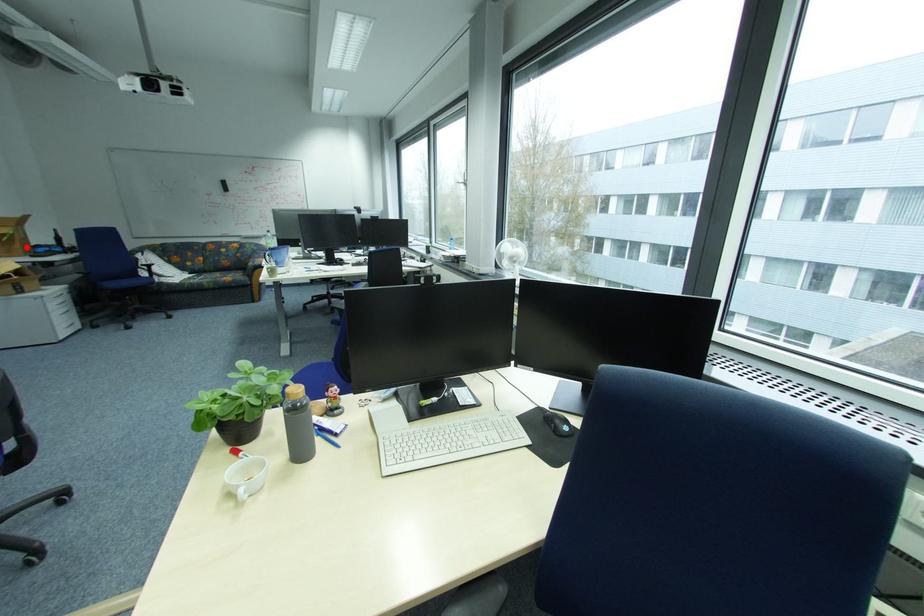
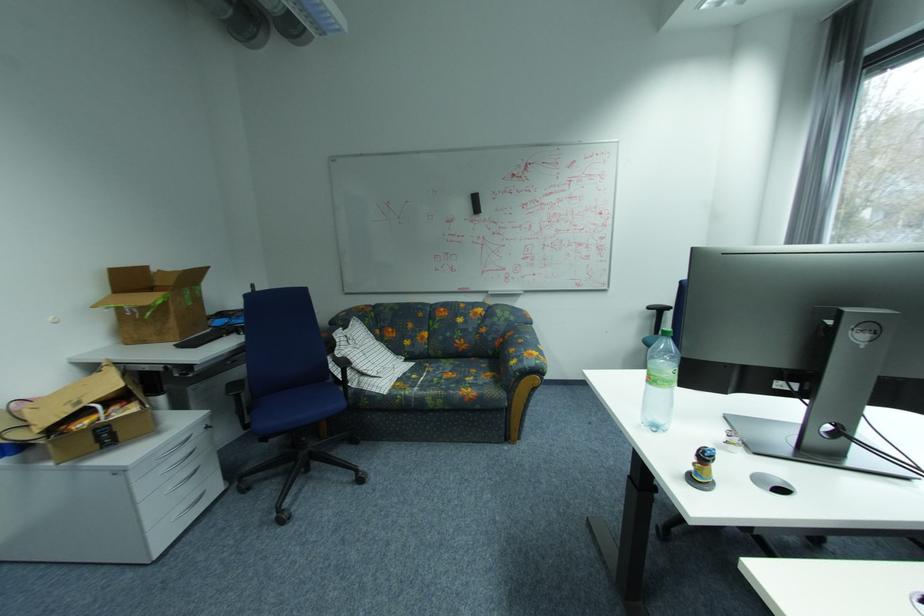
Question: I am providing you with two images of the same scene from different viewpoints. Given a red point in image1, look at the same physical point in image2. Is it:

Choices:
 (A) Closer to the viewpoint
 (B) Farther from the viewpoint

Answer: (A)